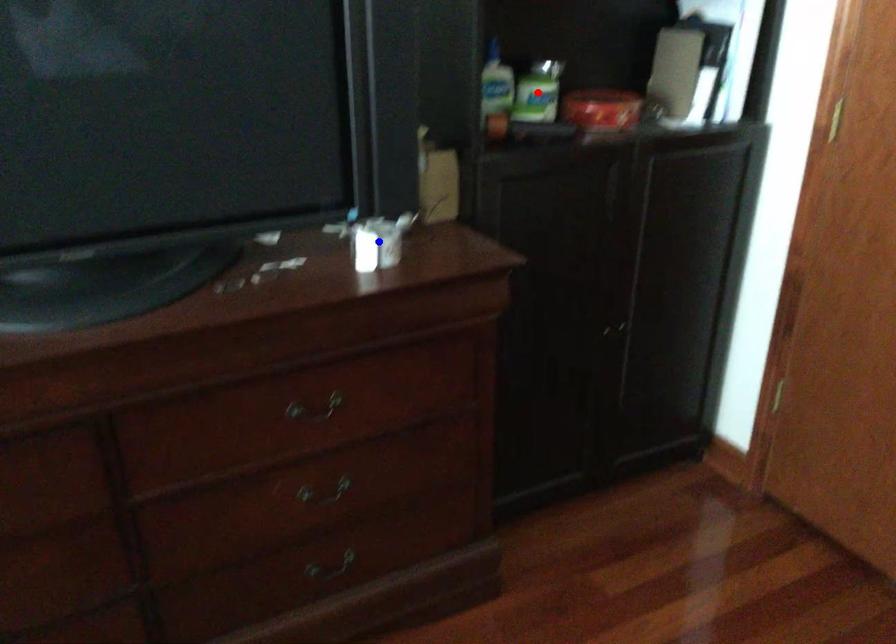
Question: In the image, two points are highlighted. Which point is nearer to the camera? Reply with the corresponding letter.

Choices:
 (A) blue point
 (B) red point

Answer: (A)